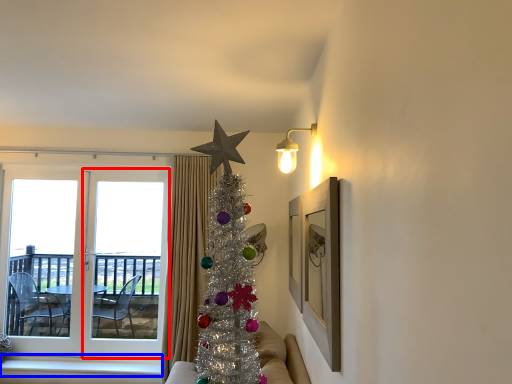
Question: Which of the following is the farthest to the observer, screen door (highlighted by a red box) or window sill (highlighted by a blue box)?

Choices:
 (A) screen door
 (B) window sill

Answer: (A)